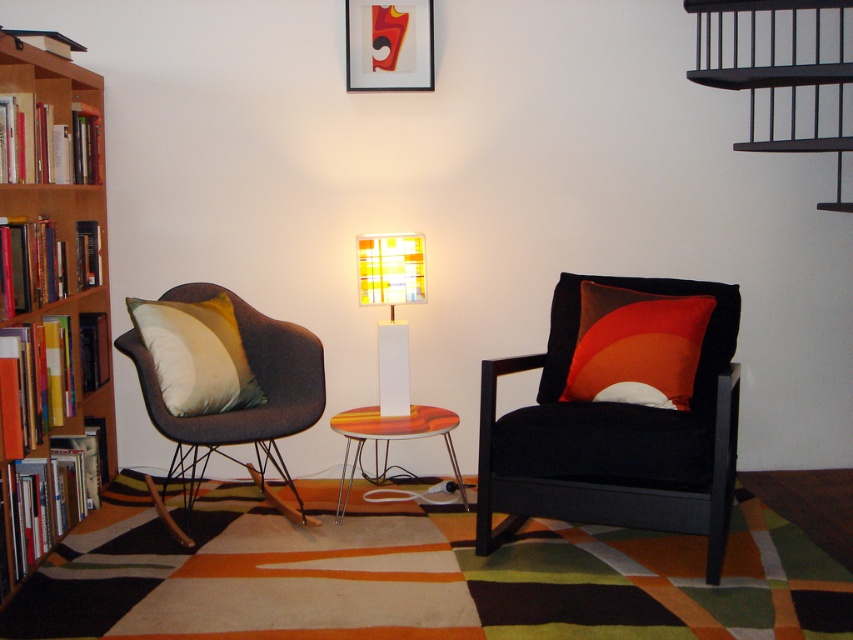
In the scene shown: You are sitting in the dark gray fabric swivel chair at left and want to reach the matte orange cushion at right. Can you directly grab it without moving your chair?

The dark gray fabric swivel chair at left is in front of the matte orange cushion at right, so you can directly grab the matte orange cushion at right without needing to move your chair.